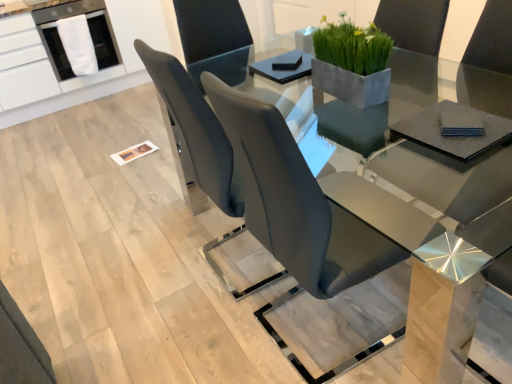
Question: From a real-world perspective, is matte gray chair at center, which is the second chair in left-to-right order, located higher than green matte concrete planter at upper center?

Choices:
 (A) yes
 (B) no

Answer: (B)

Question: Is matte gray chair at center, which is the second chair in left-to-right order, oriented towards green matte concrete planter at upper center?

Choices:
 (A) no
 (B) yes

Answer: (A)

Question: Is matte gray chair at center, which is the second chair in left-to-right order, outside green matte concrete planter at upper center?

Choices:
 (A) yes
 (B) no

Answer: (A)

Question: Is matte gray chair at center, positioned as the 1th chair in right-to-left order, further to camera compared to green matte concrete planter at upper center?

Choices:
 (A) no
 (B) yes

Answer: (A)

Question: Considering the relative sizes of matte gray chair at center, positioned as the 1th chair in right-to-left order, and green matte concrete planter at upper center in the image provided, is matte gray chair at center, positioned as the 1th chair in right-to-left order, shorter than green matte concrete planter at upper center?

Choices:
 (A) no
 (B) yes

Answer: (A)

Question: Does matte gray chair at center, positioned as the 1th chair in right-to-left order, appear on the left side of green matte concrete planter at upper center?

Choices:
 (A) no
 (B) yes

Answer: (B)

Question: Can you confirm if matte gray chair at center, marked as the first chair in a left-to-right arrangement, is positioned to the left of matte gray chair at center, positioned as the 1th chair in right-to-left order?

Choices:
 (A) no
 (B) yes

Answer: (B)

Question: From the image's perspective, is matte gray chair at center, the 2th chair when ordered from right to left, beneath matte gray chair at center, positioned as the 1th chair in right-to-left order?

Choices:
 (A) yes
 (B) no

Answer: (B)

Question: Can you see matte gray chair at center, the 2th chair when ordered from right to left, touching matte gray chair at center, which is the second chair in left-to-right order?

Choices:
 (A) yes
 (B) no

Answer: (B)

Question: Considering the relative sizes of matte gray chair at center, the 2th chair when ordered from right to left, and matte gray chair at center, which is the second chair in left-to-right order, in the image provided, is matte gray chair at center, the 2th chair when ordered from right to left, smaller than matte gray chair at center, which is the second chair in left-to-right order,?

Choices:
 (A) yes
 (B) no

Answer: (B)

Question: From the image's perspective, is matte gray chair at center, marked as the first chair in a left-to-right arrangement, on top of matte gray chair at center, which is the second chair in left-to-right order?

Choices:
 (A) no
 (B) yes

Answer: (B)

Question: Is matte gray chair at center, the 2th chair when ordered from right to left, further to the viewer compared to matte gray chair at center, which is the second chair in left-to-right order?

Choices:
 (A) no
 (B) yes

Answer: (B)

Question: Does matte gray chair at center, positioned as the 1th chair in right-to-left order, appear on the right side of white fabric at upper left?

Choices:
 (A) yes
 (B) no

Answer: (A)